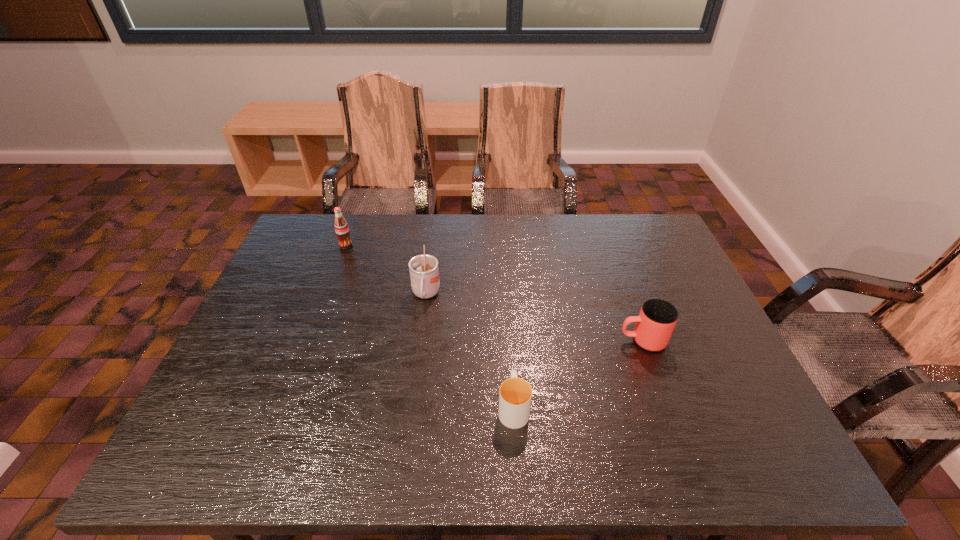
You are a GUI agent. You are given a task and a screenshot of the screen. Output one action in this format:
    pyautogui.click(x=<x>, y=<y>)
    Task: Click on the object positioned at the far left corner
    The width and height of the screenshot is (960, 540).
    Given the screenshot: What is the action you would take?
    pyautogui.click(x=341, y=227)

Identify the location of vacant space at the far edge of the desktop. (392, 259).

The width and height of the screenshot is (960, 540). I want to click on vacant space at the left edge of the desktop, so click(x=311, y=285).

Identify the location of vacant space at the right edge of the desktop. Image resolution: width=960 pixels, height=540 pixels. (683, 299).

This screenshot has height=540, width=960. In the image, there is a desktop. Identify the location of vacant space at the near left corner. (223, 460).

Locate an element on the screen. Image resolution: width=960 pixels, height=540 pixels. unoccupied area between the second cup from left to right and the rightmost cup is located at coordinates (578, 374).

This screenshot has width=960, height=540. I want to click on vacant area that lies between the farthest object and the third farthest object, so click(x=494, y=293).

Identify the location of unoccupied area between the farthest object and the rightmost cup. (494, 293).

The width and height of the screenshot is (960, 540). I want to click on free point between the soda and the second cup from right to left, so pos(430,327).

Identify the location of unoccupied position between the second shortest cup and the nearest object. (578, 374).